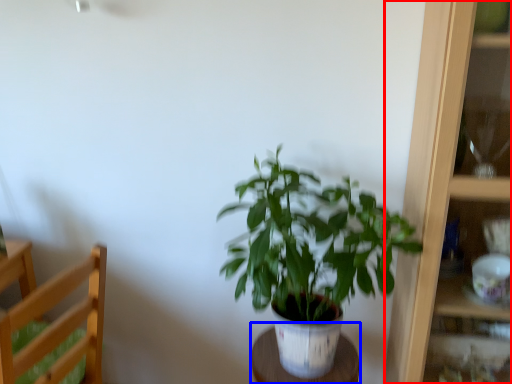
Question: Among these objects, which one is farthest to the camera, cabinet (highlighted by a red box) or table (highlighted by a blue box)?

Choices:
 (A) cabinet
 (B) table

Answer: (B)